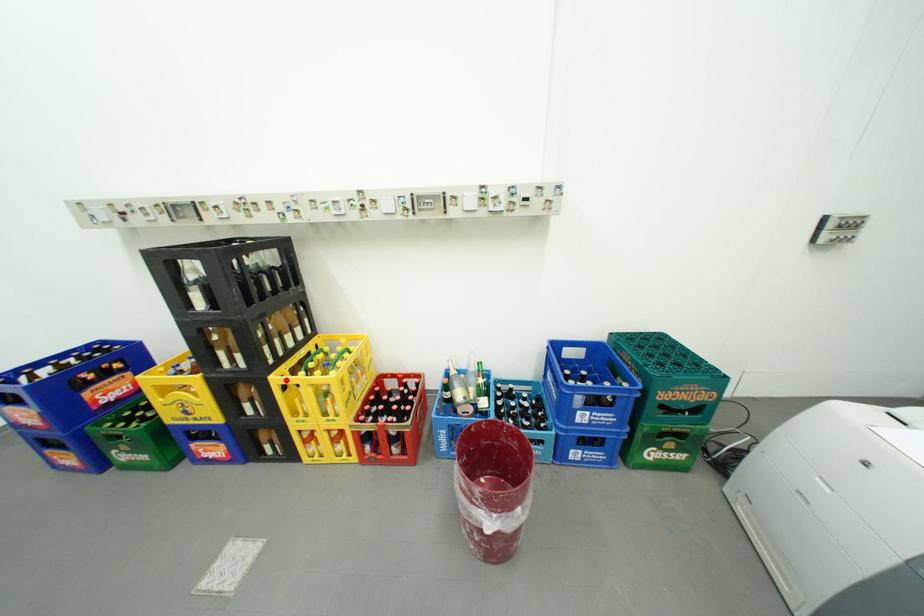
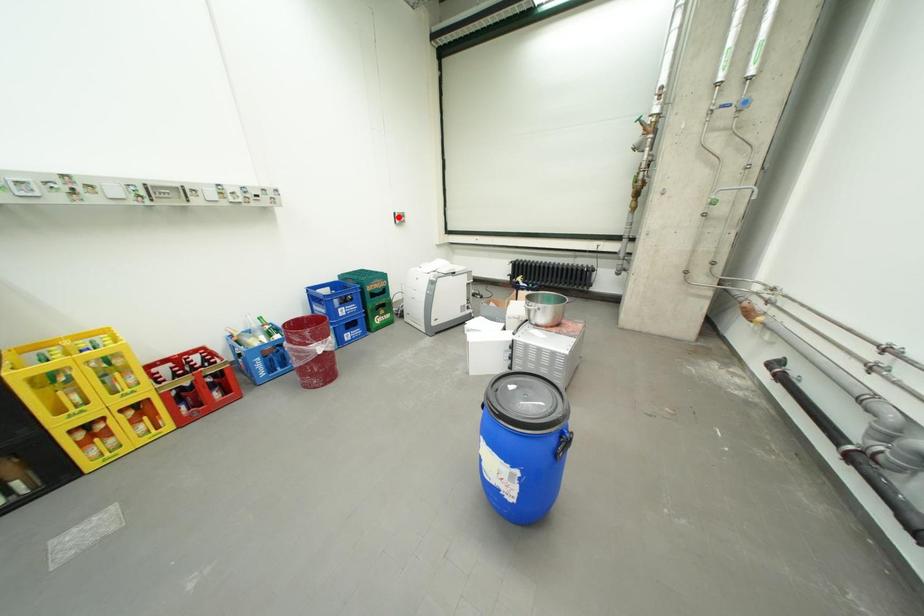
I am providing you with two images of the same scene from different viewpoints. A red point is marked on the first image and another point is marked on the second image. Are the points marked in image1 and image2 representing the same 3D position?

No